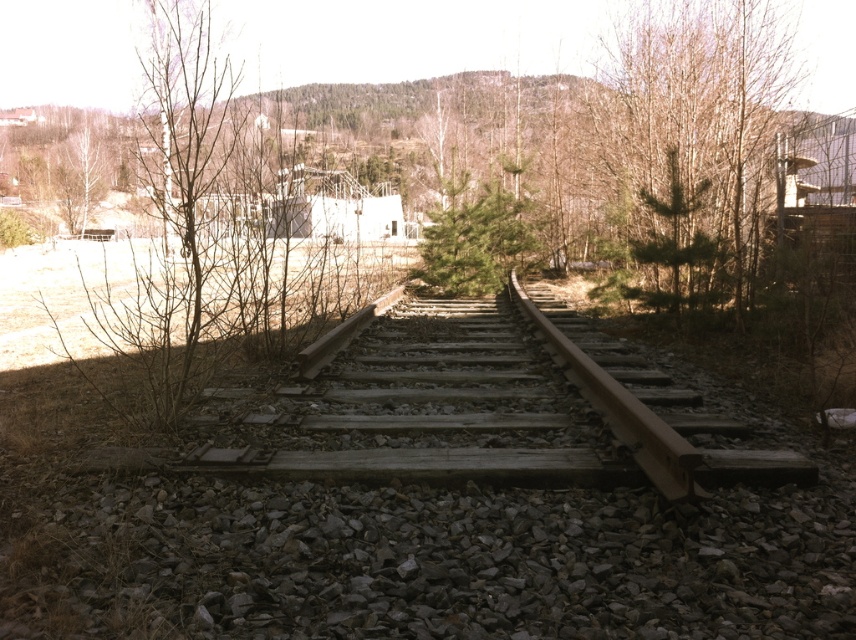
Question: Considering the relative positions of brown wooden train track at center and green leafy tree at upper right in the image provided, where is brown wooden train track at center located with respect to green leafy tree at upper right?

Choices:
 (A) below
 (B) above

Answer: (A)

Question: Is bare branches at left wider than green leafy tree at upper right?

Choices:
 (A) yes
 (B) no

Answer: (A)

Question: Can you confirm if brown wooden train track at center is bigger than green leafy tree at upper right?

Choices:
 (A) yes
 (B) no

Answer: (B)

Question: Which object appears farthest from the camera in this image?

Choices:
 (A) brown wooden train track at center
 (B) green leafy tree at upper right
 (C) bare branches at left

Answer: (B)

Question: Which object is the closest to the bare branches at left?

Choices:
 (A) green matte tree at center
 (B) brown wooden train track at center

Answer: (B)

Question: Which object appears closest to the camera in this image?

Choices:
 (A) green leafy tree at upper right
 (B) brown wooden train track at center

Answer: (B)